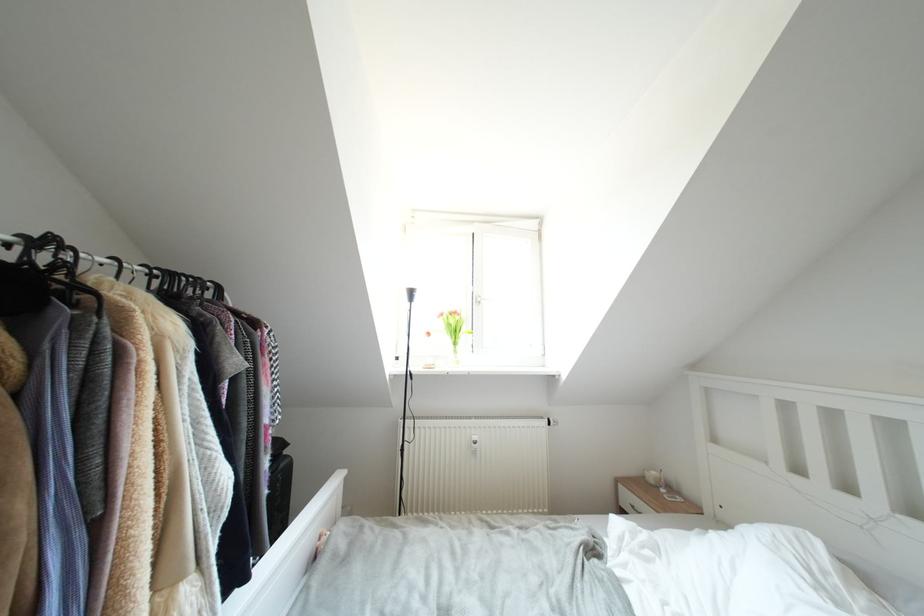
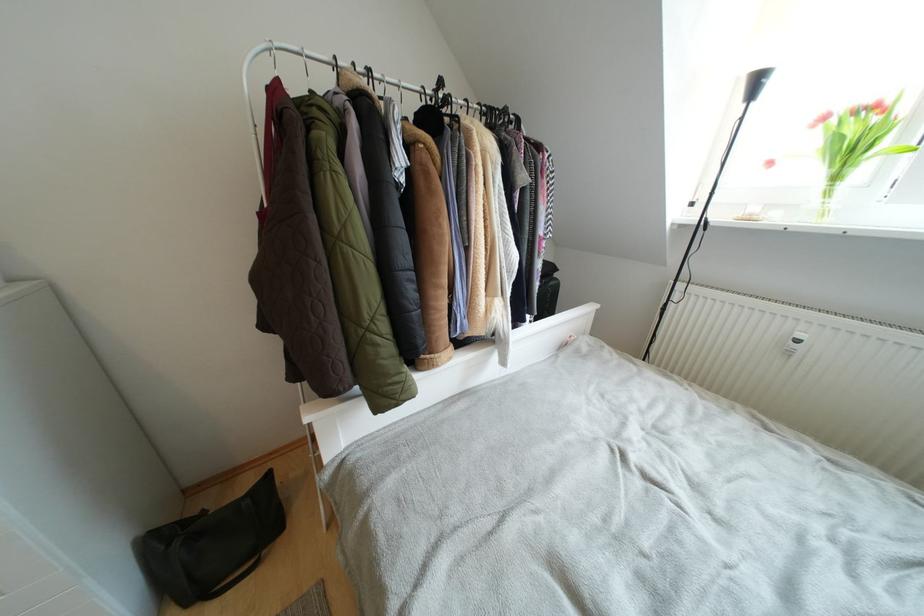
Where in the second image is the point corresponding to [459,347] from the first image?

(840, 182)